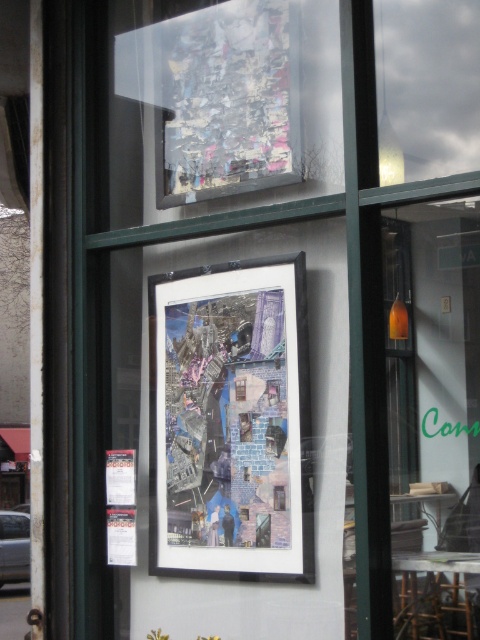
Between matte black collage at center and metallic collage at upper center, which one is positioned lower?

matte black collage at center is lower down.

Who is positioned more to the left, matte black collage at center or metallic collage at upper center?

metallic collage at upper center

At what (x,y) coordinates should I click in order to perform the action: click on matte black collage at center. Please return your answer as a coordinate pair (x, y). The width and height of the screenshot is (480, 640). Looking at the image, I should click on (229, 420).

Locate an element on the screen. matte black collage at center is located at coordinates (229, 420).